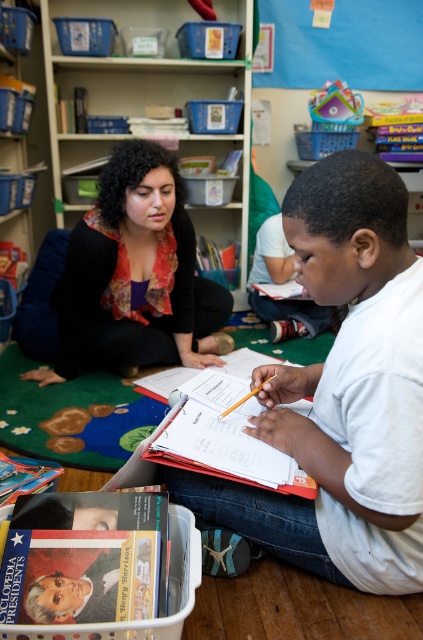
Which is in front, point (219, 509) or point (180, 312)?

Positioned in front is point (219, 509).

Is point (269, 536) positioned behind point (178, 218)?

No.

At what (x,y) coordinates should I click in order to perform the action: click on white matte shirt at center. Please return your answer as a coordinate pair (x, y). The width and height of the screenshot is (423, 640). Looking at the image, I should click on (343, 392).

At what (x,y) coordinates should I click in order to perform the action: click on white matte shirt at center. Please return your answer as a coordinate pair (x, y). This screenshot has width=423, height=640. Looking at the image, I should click on (343, 392).

Does point (57, 500) come farther from viewer compared to point (252, 477)?

No, (57, 500) is closer to viewer.

Between point (164, 592) and point (186, 435), which one is positioned behind?

Point (186, 435)

Which is in front, point (38, 604) or point (250, 461)?

Point (38, 604) is more forward.

Locate an element on the screen. This screenshot has height=640, width=423. hardcover book at lower left is located at coordinates (85, 557).

Is white matte shirt at center bigger than white paper at center?

Indeed, white matte shirt at center has a larger size compared to white paper at center.

Is white matte shirt at center above white paper at center?

Correct, white matte shirt at center is located above white paper at center.

Is point (225, 484) closer to viewer compared to point (175, 442)?

No.

Where is `white matte shirt at center`? This screenshot has height=640, width=423. white matte shirt at center is located at coordinates (343, 392).